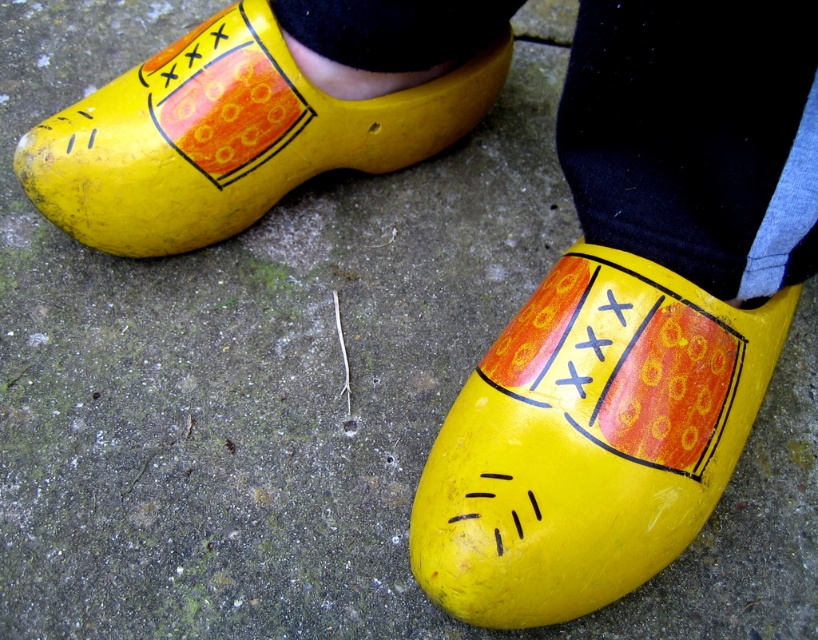
Who is more forward, (515,448) or (180,236)?

Positioned in front is point (515,448).

Is point (569, 508) closer to viewer compared to point (464, 124)?

Yes, point (569, 508) is closer to viewer.

Which is in front, point (524, 515) or point (160, 225)?

Positioned in front is point (524, 515).

I want to click on yellow painted wood shoe at lower right, so click(x=589, y=440).